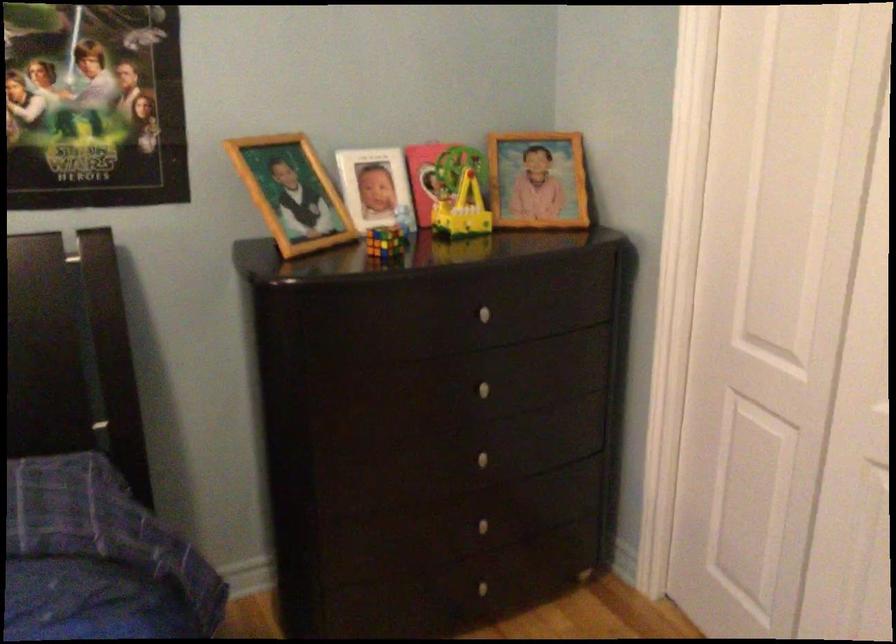
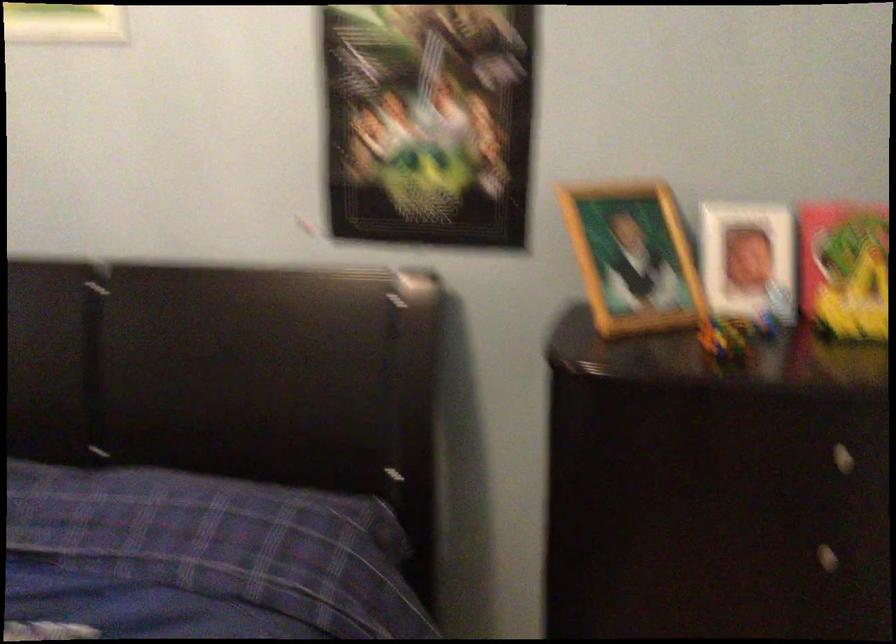
Find the pixel in the second image that matches pixel 487 316 in the first image.

(840, 458)